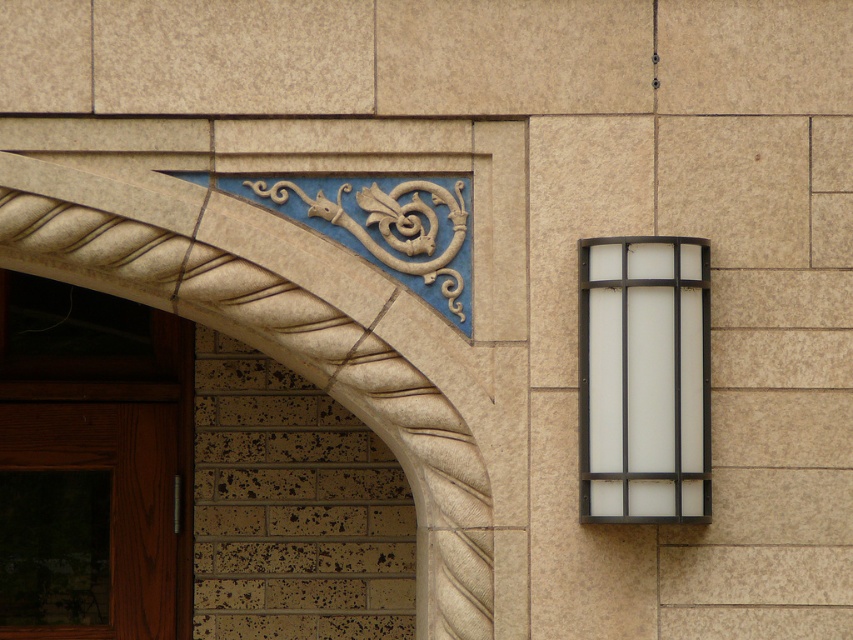
Does brown wooden door at lower left come behind carved stone archway at upper left?

Yes.

Is point (115, 404) more distant than point (339, 336)?

That is True.

Find the location of a particular element. brown wooden door at lower left is located at coordinates (90, 464).

What do you see at coordinates (273, 355) in the screenshot?
I see `carved stone archway at upper left` at bounding box center [273, 355].

Which is in front, point (451, 483) or point (628, 406)?

Point (628, 406)

Who is more distant from viewer, (379, 364) or (636, 522)?

The point (379, 364) is behind.

I want to click on carved stone archway at upper left, so (273, 355).

Based on the photo, which of these two, brown wooden door at lower left or white frosted glass at right, stands shorter?

white frosted glass at right is shorter.

Between brown wooden door at lower left and white frosted glass at right, which one has more height?

brown wooden door at lower left is taller.

Identify the location of brown wooden door at lower left. Image resolution: width=853 pixels, height=640 pixels. (90, 464).

Identify the location of brown wooden door at lower left. The image size is (853, 640). (90, 464).